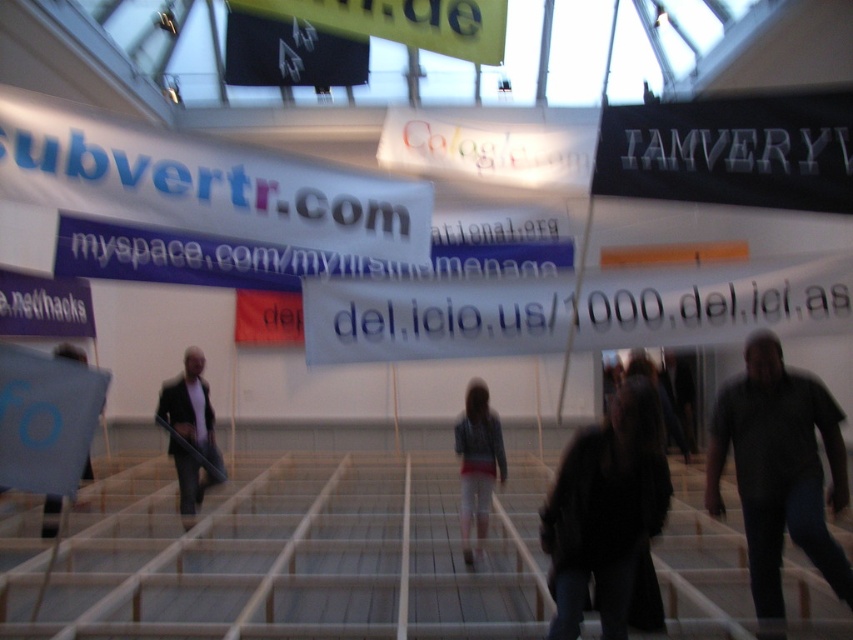
You are organizing a conference and need to hang two banners. You have a white paper banner at upper left and a black paper at left. The venue requires that the wider banner must be placed in the center for visibility. Which banner should you place centrally?

Answer: The white paper banner at upper left is wider than the black paper at left, so it should be placed centrally as per the venue requirement.

You are standing in the hall and want to locate the white paper banner at center. According to the coordinates provided, where would you find it?

The white paper banner at center is located at coordinates point (x=573, y=310).